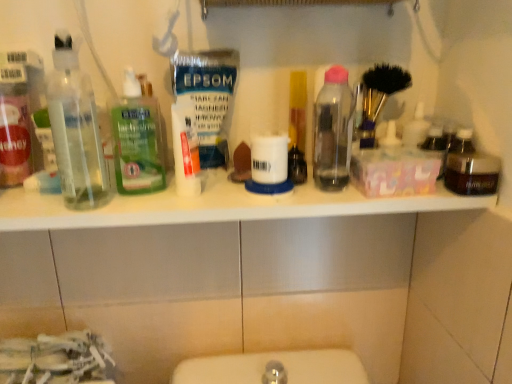
Question: Is white plastic shelf at upper center turned away from transparent plastic bottle at center, which is the second bottle from right to left?

Choices:
 (A) no
 (B) yes

Answer: (A)

Question: Is white plastic shelf at upper center positioned before transparent plastic bottle at center, arranged as the third bottle when viewed from the left?

Choices:
 (A) yes
 (B) no

Answer: (A)

Question: Is white plastic shelf at upper center thinner than transparent plastic bottle at center, arranged as the third bottle when viewed from the left?

Choices:
 (A) yes
 (B) no

Answer: (B)

Question: Is the position of white plastic shelf at upper center more distant than that of transparent plastic bottle at center, which is the second bottle from right to left?

Choices:
 (A) yes
 (B) no

Answer: (B)

Question: Is white plastic shelf at upper center to the left of transparent plastic bottle at center, arranged as the third bottle when viewed from the left, from the viewer's perspective?

Choices:
 (A) yes
 (B) no

Answer: (A)

Question: Can you confirm if white plastic shelf at upper center is bigger than transparent plastic bottle at center, arranged as the third bottle when viewed from the left?

Choices:
 (A) yes
 (B) no

Answer: (A)

Question: From a real-world perspective, is transparent plastic bottle at center, arranged as the third bottle when viewed from the left, over translucent plastic bottle at center?

Choices:
 (A) no
 (B) yes

Answer: (B)

Question: Does transparent plastic bottle at center, arranged as the third bottle when viewed from the left, have a greater height compared to translucent plastic bottle at center?

Choices:
 (A) yes
 (B) no

Answer: (A)

Question: Is transparent plastic bottle at center, which is the second bottle from right to left, positioned behind translucent plastic bottle at center?

Choices:
 (A) no
 (B) yes

Answer: (A)

Question: Is transparent plastic bottle at center, arranged as the third bottle when viewed from the left, positioned in front of translucent plastic bottle at center?

Choices:
 (A) yes
 (B) no

Answer: (A)

Question: Can you confirm if transparent plastic bottle at center, which is the second bottle from right to left, is thinner than translucent plastic bottle at center?

Choices:
 (A) no
 (B) yes

Answer: (A)

Question: Considering the relative sizes of transparent plastic bottle at center, arranged as the third bottle when viewed from the left, and translucent plastic bottle at center in the image provided, is transparent plastic bottle at center, arranged as the third bottle when viewed from the left, wider than translucent plastic bottle at center?

Choices:
 (A) yes
 (B) no

Answer: (A)

Question: Is translucent plastic bottle at center positioned with its back to transparent plastic bottles at left, which appears as the first bottle when viewed from the left?

Choices:
 (A) no
 (B) yes

Answer: (A)